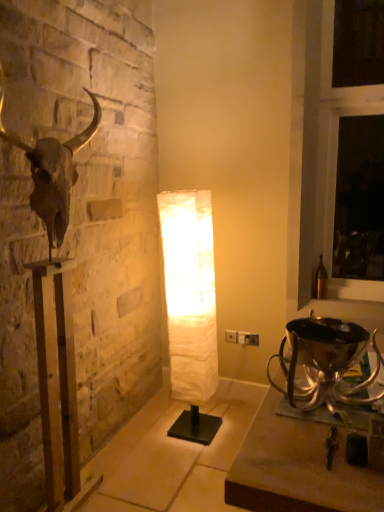
Question: Is shiny silver trophy at lower right positioned with its back to white marble lamp at center?

Choices:
 (A) no
 (B) yes

Answer: (A)

Question: From the image's perspective, does shiny silver trophy at lower right appear lower than white marble lamp at center?

Choices:
 (A) no
 (B) yes

Answer: (A)

Question: Is shiny silver trophy at lower right far from white marble lamp at center?

Choices:
 (A) yes
 (B) no

Answer: (A)

Question: From the image's perspective, is shiny silver trophy at lower right located above white marble lamp at center?

Choices:
 (A) yes
 (B) no

Answer: (A)

Question: From a real-world perspective, is shiny silver trophy at lower right positioned over white marble lamp at center based on gravity?

Choices:
 (A) no
 (B) yes

Answer: (B)

Question: Is shiny silver trophy at lower right taller than white marble lamp at center?

Choices:
 (A) yes
 (B) no

Answer: (A)

Question: Is white plastic electric outlet at center positioned far away from shiny silver trophy at lower right?

Choices:
 (A) yes
 (B) no

Answer: (A)

Question: From a real-world perspective, is white plastic electric outlet at center located higher than shiny silver trophy at lower right?

Choices:
 (A) yes
 (B) no

Answer: (B)

Question: Considering the relative positions of white plastic electric outlet at center and shiny silver trophy at lower right in the image provided, is white plastic electric outlet at center to the left of shiny silver trophy at lower right from the viewer's perspective?

Choices:
 (A) yes
 (B) no

Answer: (A)

Question: Is white plastic electric outlet at center shorter than shiny silver trophy at lower right?

Choices:
 (A) yes
 (B) no

Answer: (A)

Question: Can you confirm if white plastic electric outlet at center is positioned to the right of shiny silver trophy at lower right?

Choices:
 (A) no
 (B) yes

Answer: (A)

Question: Does white plastic electric outlet at center contain shiny silver trophy at lower right?

Choices:
 (A) yes
 (B) no

Answer: (B)

Question: Is white paper lamp at center far away from metallic gold bull skull at left?

Choices:
 (A) yes
 (B) no

Answer: (B)